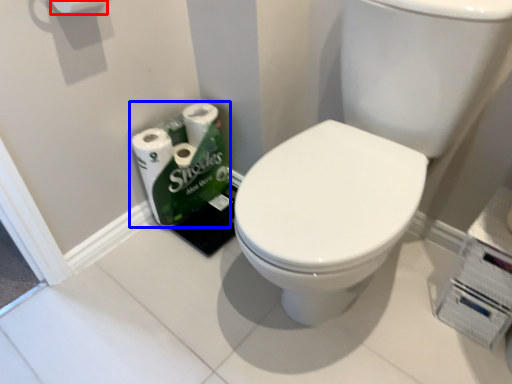
Question: Which object appears closest to the camera in this image, toilet paper (highlighted by a red box) or toilet paper (highlighted by a blue box)?

Choices:
 (A) toilet paper
 (B) toilet paper

Answer: (A)